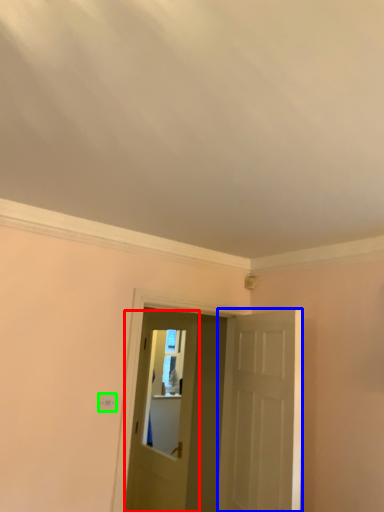
Question: Which is nearer to the door (highlighted by a red box)? door (highlighted by a blue box) or light switch (highlighted by a green box).

Choices:
 (A) door
 (B) light switch

Answer: (A)